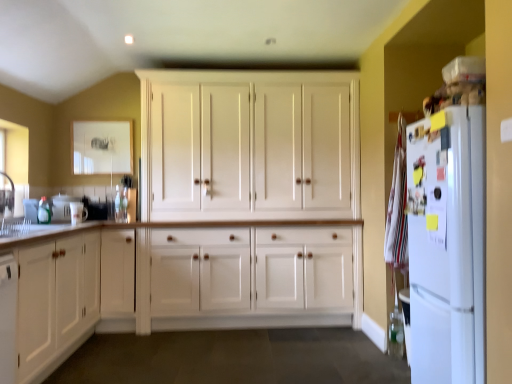
Question: Is white glossy mug at left to the right of white wood cabinet at left, which appears as the 1th cabinetry when viewed from the front, from the viewer's perspective?

Choices:
 (A) no
 (B) yes

Answer: (B)

Question: Does white glossy mug at left lie behind white wood cabinet at left, which appears as the 1th cabinetry when viewed from the front?

Choices:
 (A) yes
 (B) no

Answer: (A)

Question: From the image's perspective, is white glossy mug at left below white wood cabinet at left, which appears as the second cabinetry when viewed from the back?

Choices:
 (A) yes
 (B) no

Answer: (B)

Question: From the image's perspective, is white glossy mug at left above white wood cabinet at left, which is the second cabinetry in right-to-left order?

Choices:
 (A) no
 (B) yes

Answer: (B)

Question: Is white glossy mug at left next to white wood cabinet at left, which appears as the second cabinetry when viewed from the back?

Choices:
 (A) no
 (B) yes

Answer: (A)

Question: From a real-world perspective, is white matte refrigerator at right physically located above or below white wood cabinet at center, arranged as the 1th cabinetry when viewed from the back?

Choices:
 (A) below
 (B) above

Answer: (A)

Question: In the image, is white matte refrigerator at right positioned in front of or behind white wood cabinet at center, marked as the 2th cabinetry in a front-to-back arrangement?

Choices:
 (A) front
 (B) behind

Answer: (A)

Question: From the image's perspective, is white matte refrigerator at right located above or below white wood cabinet at center, marked as the 2th cabinetry in a front-to-back arrangement?

Choices:
 (A) above
 (B) below

Answer: (B)

Question: Is white matte refrigerator at right wider or thinner than white wood cabinet at center, arranged as the 1th cabinetry when viewed from the back?

Choices:
 (A) thin
 (B) wide

Answer: (B)

Question: From their relative heights in the image, would you say white glossy mug at left is taller or shorter than white matte refrigerator at right?

Choices:
 (A) tall
 (B) short

Answer: (B)

Question: Which is correct: white glossy mug at left is inside white matte refrigerator at right, or outside of it?

Choices:
 (A) inside
 (B) outside

Answer: (B)

Question: From a real-world perspective, is white glossy mug at left physically located above or below white matte refrigerator at right?

Choices:
 (A) above
 (B) below

Answer: (A)

Question: Based on their sizes in the image, would you say white glossy mug at left is bigger or smaller than white matte refrigerator at right?

Choices:
 (A) big
 (B) small

Answer: (B)

Question: From a real-world perspective, is white wood cabinet at center, marked as the 2th cabinetry in a front-to-back arrangement, above or below white glossy sink at left?

Choices:
 (A) above
 (B) below

Answer: (A)

Question: From the image's perspective, is white wood cabinet at center, arranged as the 1th cabinetry when viewed from the back, located above or below white glossy sink at left?

Choices:
 (A) below
 (B) above

Answer: (B)